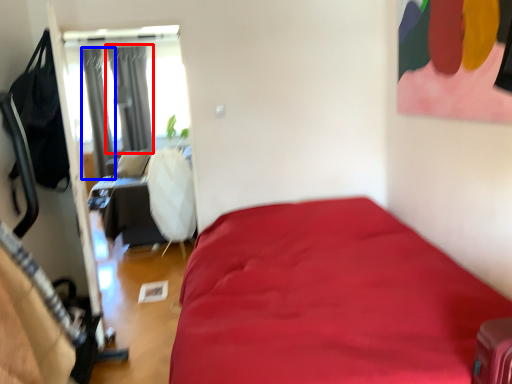
Question: Among these objects, which one is farthest to the camera, curtain (highlighted by a red box) or curtain (highlighted by a blue box)?

Choices:
 (A) curtain
 (B) curtain

Answer: (A)